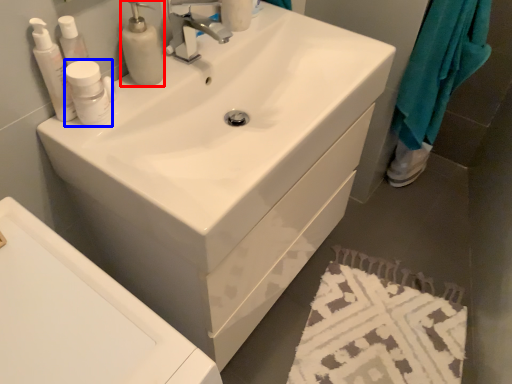
Question: Which object appears farthest to the camera in this image, soap dispenser (highlighted by a red box) or mouthwash (highlighted by a blue box)?

Choices:
 (A) soap dispenser
 (B) mouthwash

Answer: (A)